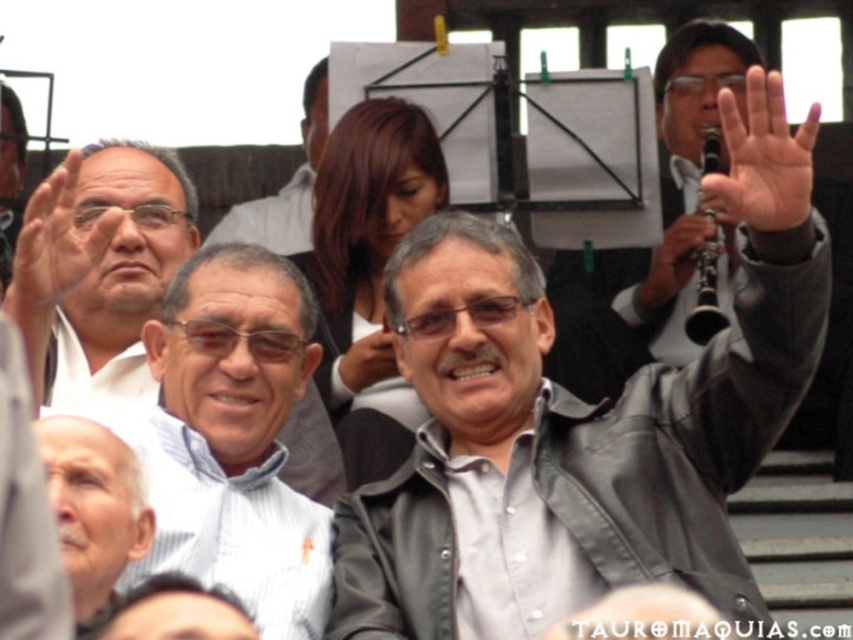
You are a photographer trying to capture the exact location of a hand in an image for a photo editing software. The software requires coordinates to place a sticker. The image has a light skin hand at upper right. What are the coordinates where you should place the sticker?

The coordinates for placing the sticker on the light skin hand at upper right are at point (763, 156).